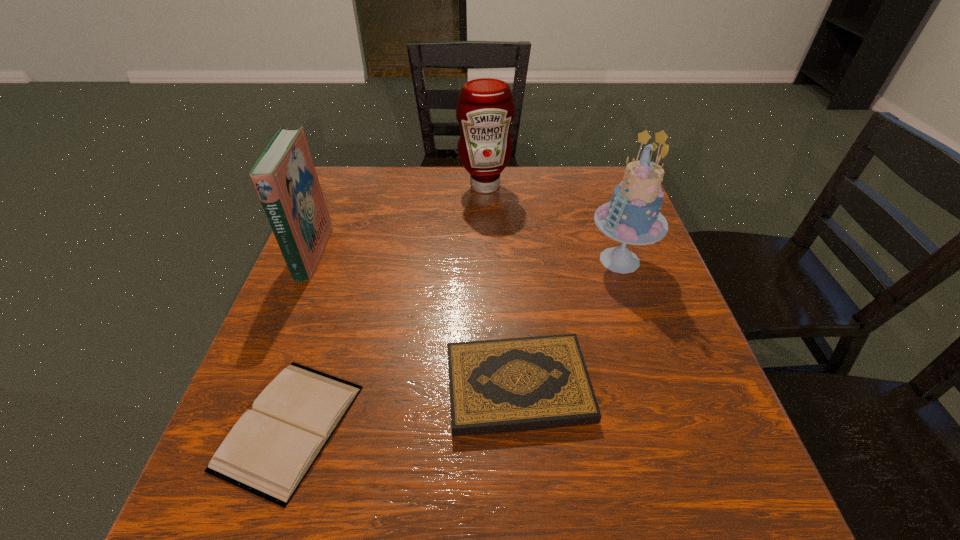
The image size is (960, 540). Find the location of `the rightmost object`. the rightmost object is located at coordinates (632, 217).

Identify the location of condiment. The height and width of the screenshot is (540, 960). (485, 109).

This screenshot has height=540, width=960. In order to click on the farthest hardback book in this screenshot , I will do (284, 176).

Image resolution: width=960 pixels, height=540 pixels. I want to click on the rightmost hardback book, so click(x=518, y=384).

Locate an element on the screen. the second tallest hardback book is located at coordinates (518, 384).

This screenshot has height=540, width=960. In order to click on the shortest hardback book in this screenshot , I will do `click(268, 452)`.

Find the location of a particular element. Image resolution: width=960 pixels, height=540 pixels. vacant space located 0.350m with a ladder on the side of the cake is located at coordinates (440, 260).

Find the location of a particular element. The image size is (960, 540). free space located with a ladder on the side of the cake is located at coordinates (562, 260).

The height and width of the screenshot is (540, 960). I want to click on free space located 0.260m with a ladder on the side of the cake, so click(x=477, y=260).

You are a GUI agent. You are given a task and a screenshot of the screen. Output one action in this format:
    pyautogui.click(x=<x>, y=<y>)
    Task: Click on the blank space located 0.300m on the front of the condiment
    Image resolution: width=960 pixels, height=540 pixels.
    Given the screenshot: What is the action you would take?
    pyautogui.click(x=486, y=269)